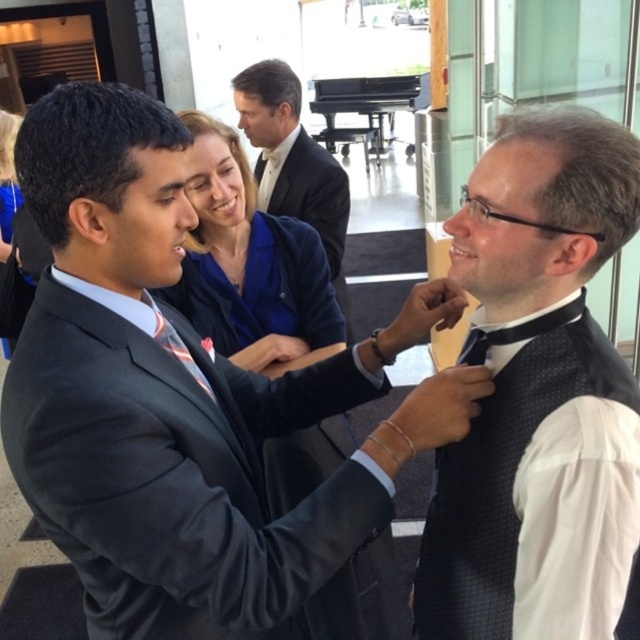
You are a photographer at a formal event and need to capture a clear photo of the black dotted vest at right and the black satin bow tie at center. Which object should you focus on first to ensure both are in focus?

The black dotted vest at right is positioned under the black satin bow tie at center, so you should focus on the black satin bow tie at center first to ensure both are in focus.

You are organizing a charity event and need to decide which outfit to display prominently. Based on the image, which of the two outfits, the matte black suit at center or the blue fabric jacket at upper center, would require more display space due to its size?

The matte black suit at center is larger in size than the blue fabric jacket at upper center, so it would require more display space.